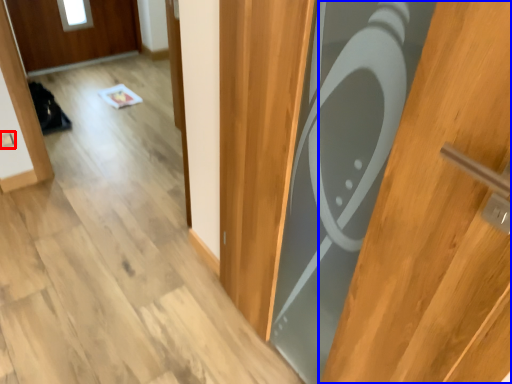
Question: Which point is closer to the camera, electric outlet (highlighted by a red box) or door (highlighted by a blue box)?

Choices:
 (A) electric outlet
 (B) door

Answer: (B)